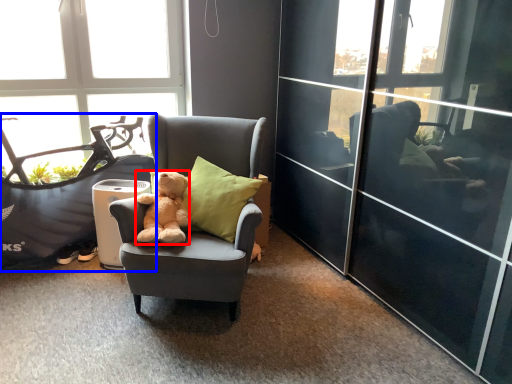
Question: Which object appears farthest to the camera in this image, teddy bear (highlighted by a red box) or mountain bike (highlighted by a blue box)?

Choices:
 (A) teddy bear
 (B) mountain bike

Answer: (B)